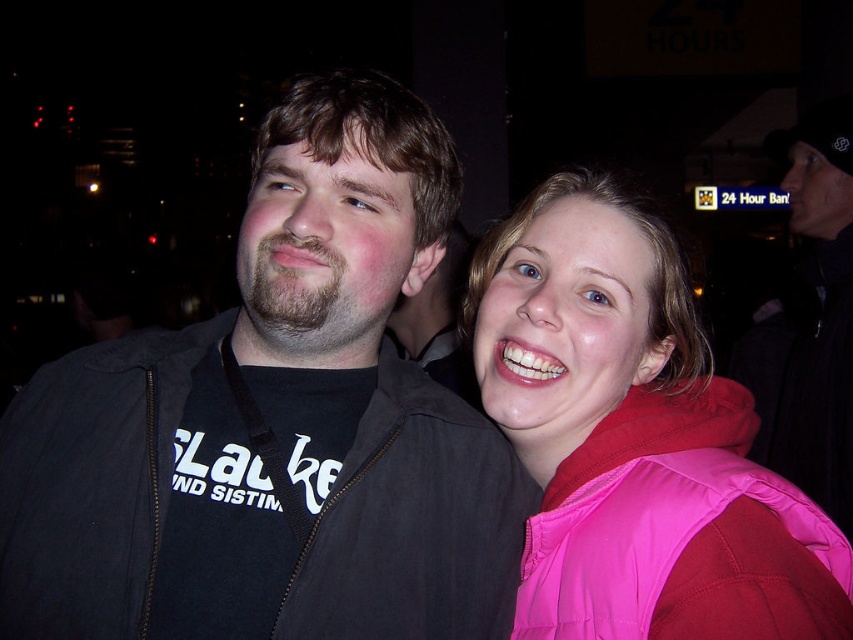
Question: Which object is farther from the camera taking this photo?

Choices:
 (A) pink fabric jacket at upper right
 (B) black matte jacket at left

Answer: (B)

Question: Which of these objects is positioned farthest from the black matte jacket at left?

Choices:
 (A) black jacket at right
 (B) pink fabric jacket at upper right

Answer: (A)

Question: Which point is farther to the camera?

Choices:
 (A) (428, 593)
 (B) (842, 401)

Answer: (B)

Question: Is black matte jacket at left thinner than black jacket at right?

Choices:
 (A) no
 (B) yes

Answer: (A)

Question: Considering the relative positions of black matte jacket at left and black jacket at right in the image provided, where is black matte jacket at left located with respect to black jacket at right?

Choices:
 (A) right
 (B) left

Answer: (B)

Question: Can you confirm if black matte jacket at left is positioned below black jacket at right?

Choices:
 (A) yes
 (B) no

Answer: (A)